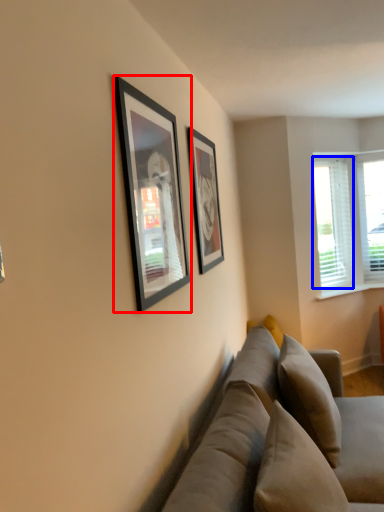
Question: Which object is further to the camera taking this photo, picture frame (highlighted by a red box) or window screen (highlighted by a blue box)?

Choices:
 (A) picture frame
 (B) window screen

Answer: (B)